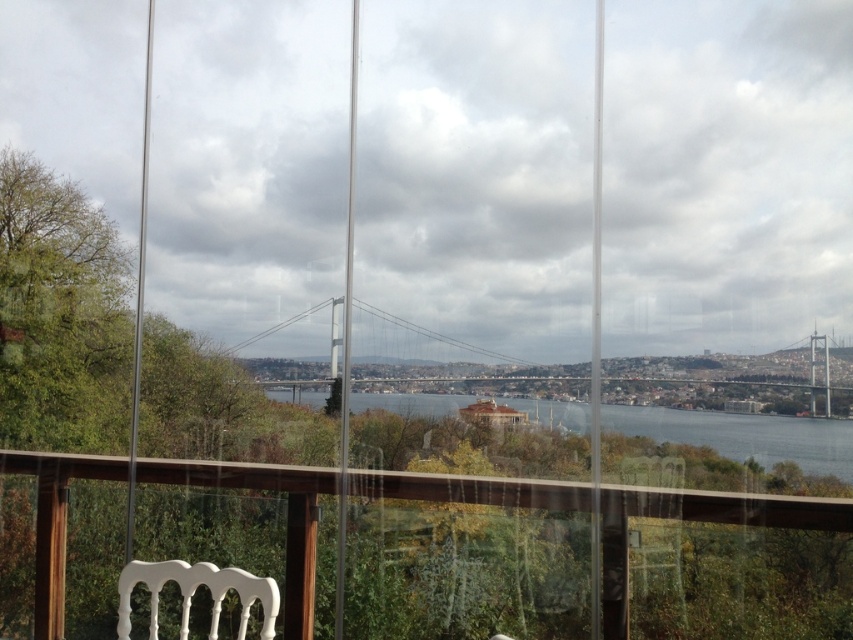
You are sitting on the white plastic chair at lower center and looking out the window. Can you see the top of the blue water at center from your current position?

The blue water at center is not as tall as the white plastic chair at lower center, so yes, you can see the top of the blue water at center from your position on the chair.

From the picture: You are standing in the room and want to look out through the transparent glass railing at center and the white plastic chair at lower center. Which object is closer to the left side of your view?

The transparent glass railing at center is closer to the left side of your view because it is positioned to the left of the white plastic chair at lower center.

You are sitting on the white plastic chair at lower center and looking out through the glass window. Can you see the blue water at center above your head?

Yes, the blue water at center is above the white plastic chair at lower center, so when sitting on the chair, you can see the water above your head through the window.